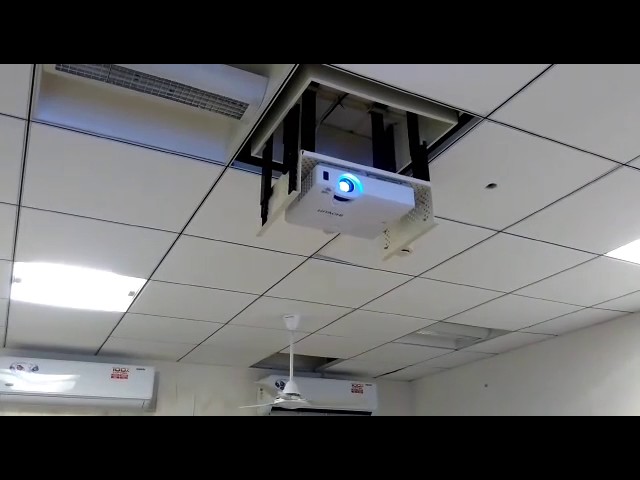
You are a GUI agent. You are given a task and a screenshot of the screen. Output one action in this format:
    pyautogui.click(x=<x>, y=<y>)
    Task: Click on the projector mounting
    
    Given the screenshot: What is the action you would take?
    pyautogui.click(x=419, y=184)